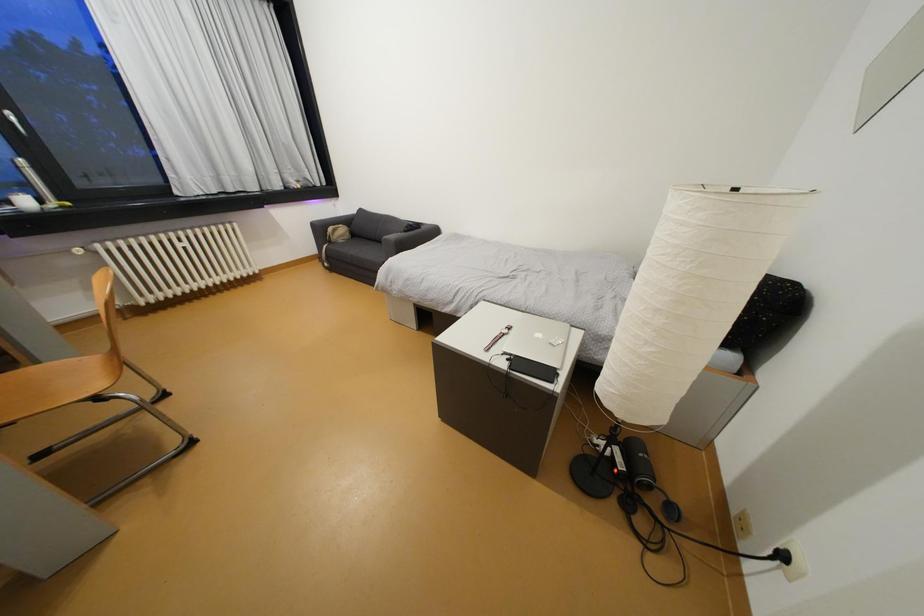
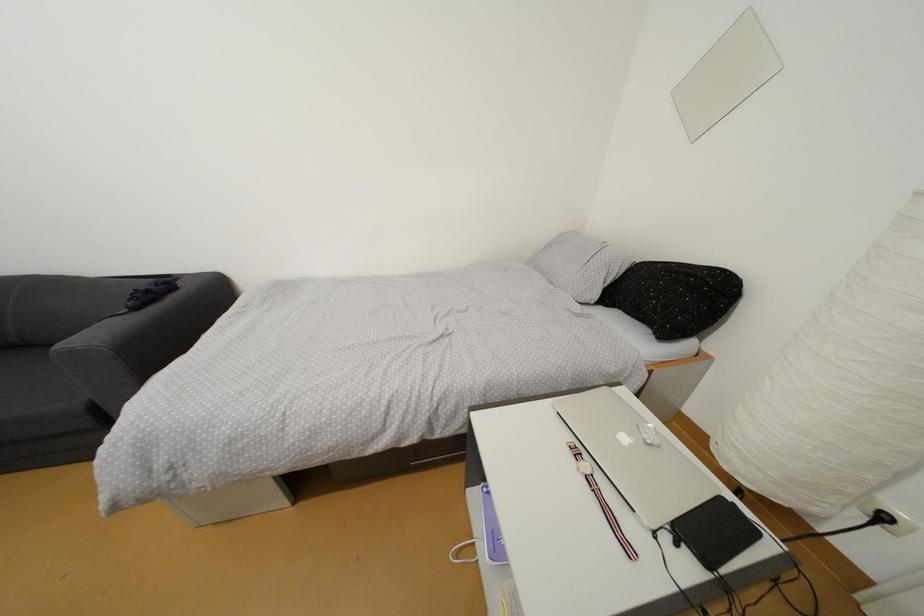
Question: The camera is either moving clockwise (left) or counter-clockwise (right) around the object. The first image is from the beginning of the video and the second image is from the end. Is the camera moving left or right when shooting the video?

Choices:
 (A) Left
 (B) Right

Answer: (A)